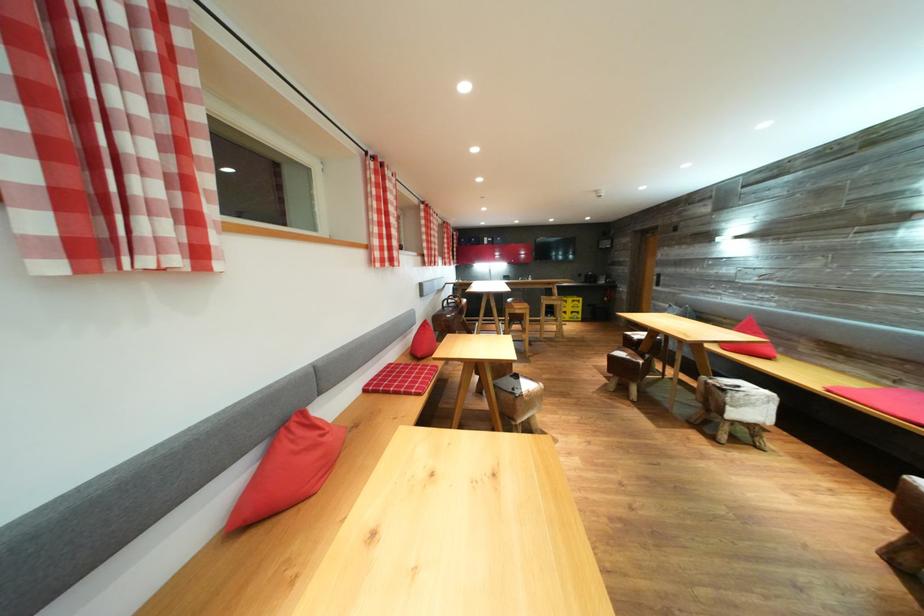
Which object does [288,469] point to?

It corresponds to the red pillow in the image.